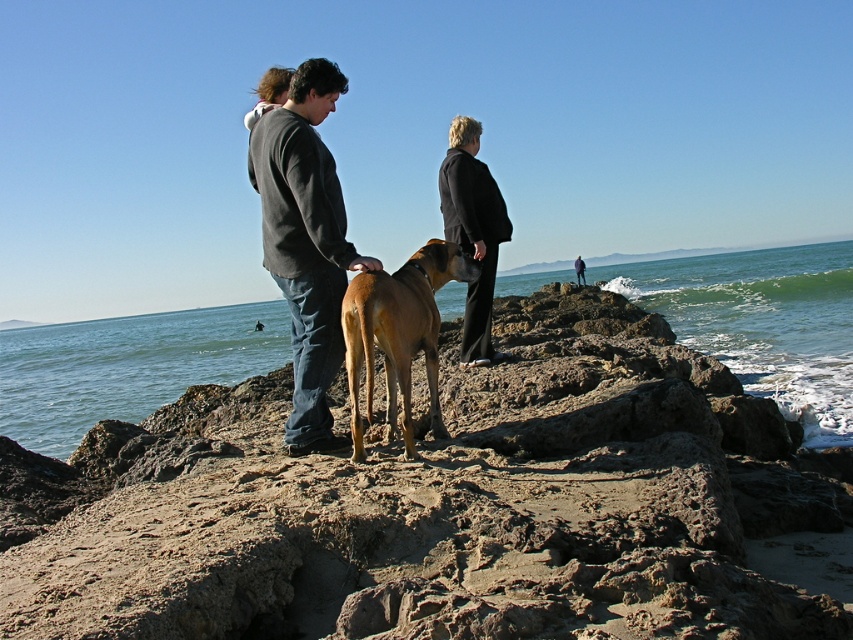
You are a photographer trying to capture the scene. You want to place your camera at the point with coordinates point (306,243). What object will be at the center of your photo?

The point (306,243) corresponds to dark gray hoodie at center, so the dark gray hoodie at center will be at the center of your photo.

You are a photographer trying to capture a photo of the dark gray hoodie at center and the black wool coat at center. Which clothing item will appear larger in the photo due to its position?

The dark gray hoodie at center is shorter than the black wool coat at center, so the black wool coat at center will appear larger in the photo because it is taller.